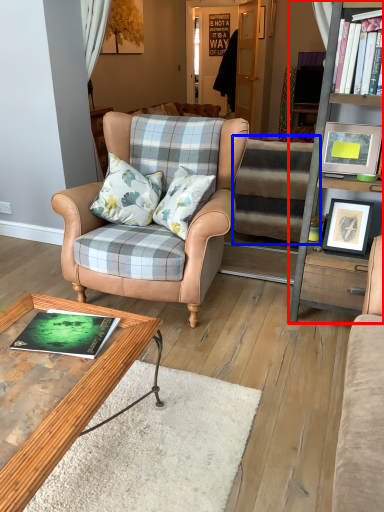
Question: Which point is further to the camera, cabinetry (highlighted by a red box) or stairwell (highlighted by a blue box)?

Choices:
 (A) cabinetry
 (B) stairwell

Answer: (B)